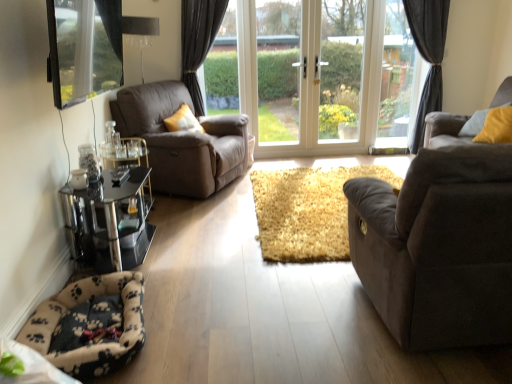
Describe the element at coordinates (182, 140) in the screenshot. I see `matte brown leather armchair at left` at that location.

This screenshot has height=384, width=512. Describe the element at coordinates (398, 80) in the screenshot. I see `clear glass window at upper center, the 1th window frame in the right-to-left sequence` at that location.

Where is `transparent glass window at upper left`? The height and width of the screenshot is (384, 512). transparent glass window at upper left is located at coordinates (83, 49).

This screenshot has height=384, width=512. Describe the element at coordinates (183, 121) in the screenshot. I see `matte yellow pillow at center, which ranks as the 1th pillow in back-to-front order` at that location.

The width and height of the screenshot is (512, 384). Describe the element at coordinates (109, 220) in the screenshot. I see `black glass table at lower left` at that location.

I want to click on dark gray fabric curtain at upper right, so click(428, 56).

Is yellow velvet pillow at right, positioned as the 1th pillow in front-to-back order, facing away from transparent glass window at upper left?

No, transparent glass window at upper left is not at the back of yellow velvet pillow at right, positioned as the 1th pillow in front-to-back order.

Is yellow velvet pillow at right, positioned as the 1th pillow in front-to-back order, not near transparent glass window at upper left?

yellow velvet pillow at right, positioned as the 1th pillow in front-to-back order, is far away from transparent glass window at upper left.

Is transparent glass window at upper left completely or partially inside yellow velvet pillow at right, marked as the 2th pillow in a left-to-right arrangement?

Definitely not — transparent glass window at upper left is not inside yellow velvet pillow at right, marked as the 2th pillow in a left-to-right arrangement.

How many degrees apart are the facing directions of yellow velvet pillow at right, positioned as the 1th pillow in front-to-back order, and transparent glass window at upper left?

yellow velvet pillow at right, positioned as the 1th pillow in front-to-back order, and transparent glass window at upper left are facing 144 degrees away from each other.

Between fluffy beige and black paw print cat bed at lower left, the first cat bed viewed from the left, and matte brown leather armchair at left, which one has less height?

fluffy beige and black paw print cat bed at lower left, the first cat bed viewed from the left.

Are fluffy beige and black paw print cat bed at lower left, which is the first cat bed from bottom to top, and matte brown leather armchair at left located far from each other?

Yes.

Is fluffy beige and black paw print cat bed at lower left, the 2th cat bed when ordered from back to front, wider or thinner than matte brown leather armchair at left?

Clearly, fluffy beige and black paw print cat bed at lower left, the 2th cat bed when ordered from back to front, has less width compared to matte brown leather armchair at left.

Consider the image. How many degrees apart are the facing directions of fluffy beige and black paw print cat bed at lower left, the first cat bed viewed from the left, and matte brown leather armchair at left?

The facing directions of fluffy beige and black paw print cat bed at lower left, the first cat bed viewed from the left, and matte brown leather armchair at left are 24.4 degrees apart.

Is yellow velvet pillow at right, marked as the 2th pillow in a left-to-right arrangement, outside of matte yellow pillow at center, which is the second pillow from front to back?

yellow velvet pillow at right, marked as the 2th pillow in a left-to-right arrangement, lies outside matte yellow pillow at center, which is the second pillow from front to back,'s area.

Does point (507, 103) lie behind point (183, 120)?

No, (507, 103) is closer to viewer.

Does yellow velvet pillow at right, which ranks as the second pillow in back-to-front order, appear on the right side of matte yellow pillow at center, placed as the first pillow when sorted from left to right?

Yes, yellow velvet pillow at right, which ranks as the second pillow in back-to-front order, is to the right of matte yellow pillow at center, placed as the first pillow when sorted from left to right.

Which is behind, yellow velvet pillow at right, marked as the 2th pillow in a left-to-right arrangement, or matte yellow pillow at center, the second pillow when ordered from right to left?

matte yellow pillow at center, the second pillow when ordered from right to left, is further from the camera.

From a real-world perspective, between transparent glass window at upper left and white glass door at center, which ranks as the first window frame in left-to-right order, who is vertically lower?

From a 3D spatial view, white glass door at center, which ranks as the first window frame in left-to-right order, is below.

Are transparent glass window at upper left and white glass door at center, the 2th window frame in the right-to-left sequence, located far from each other?

Absolutely, transparent glass window at upper left is distant from white glass door at center, the 2th window frame in the right-to-left sequence.

Can you confirm if suede-like brown couch at right, arranged as the 1th studio couch when viewed from the left, is wider than dark gray fabric curtain at upper right?

Correct, the width of suede-like brown couch at right, arranged as the 1th studio couch when viewed from the left, exceeds that of dark gray fabric curtain at upper right.

From the image's perspective, would you say suede-like brown couch at right, the 1th studio couch when ordered from front to back, is positioned over dark gray fabric curtain at upper right?

Actually, suede-like brown couch at right, the 1th studio couch when ordered from front to back, appears below dark gray fabric curtain at upper right in the image.

How many degrees apart are the facing directions of suede-like brown couch at right, acting as the 2th studio couch starting from the right, and dark gray fabric curtain at upper right?

suede-like brown couch at right, acting as the 2th studio couch starting from the right, and dark gray fabric curtain at upper right are facing 179 degrees away from each other.

Would you consider suede-like brown couch at right, acting as the 2th studio couch starting from the right, to be distant from dark gray fabric curtain at upper right?

Yes, suede-like brown couch at right, acting as the 2th studio couch starting from the right, and dark gray fabric curtain at upper right are located far from each other.

Is white glossy door at center thinner than matte yellow pillow at center, placed as the first pillow when sorted from left to right?

Yes, white glossy door at center is thinner than matte yellow pillow at center, placed as the first pillow when sorted from left to right.

Is white glossy door at center aimed at matte yellow pillow at center, which is the second pillow from front to back?

Yes, white glossy door at center is oriented towards matte yellow pillow at center, which is the second pillow from front to back.

Does white glossy door at center come behind matte yellow pillow at center, which is the second pillow from front to back?

Yes, it is.

Would you say white glossy door at center is a long distance from matte yellow pillow at center, the second pillow when ordered from right to left?

Yes.

Is matte brown leather armchair at left taller or shorter than suede-like brown couch at right, the second studio couch viewed from the top?

matte brown leather armchair at left is taller than suede-like brown couch at right, the second studio couch viewed from the top.

Considering the relative sizes of matte brown leather armchair at left and suede-like brown couch at right, placed as the second studio couch when sorted from back to front, in the image provided, is matte brown leather armchair at left bigger than suede-like brown couch at right, placed as the second studio couch when sorted from back to front,?

No, matte brown leather armchair at left is not bigger than suede-like brown couch at right, placed as the second studio couch when sorted from back to front.

In terms of width, does matte brown leather armchair at left look wider or thinner when compared to suede-like brown couch at right, placed as the second studio couch when sorted from back to front?

matte brown leather armchair at left is thinner than suede-like brown couch at right, placed as the second studio couch when sorted from back to front.

Is matte brown leather armchair at left not inside suede-like brown couch at right, the 1th studio couch when ordered from front to back?

Absolutely, matte brown leather armchair at left is external to suede-like brown couch at right, the 1th studio couch when ordered from front to back.

From a real-world perspective, starting from the transparent glass window at upper left, which pillow is the 1st one below it? Please provide its 2D coordinates.

[(474, 124)]

Where is `chair lying on the right of fluffy beige and black paw print cat bed at lower left, which ranks as the first cat bed in front-to-back order`? chair lying on the right of fluffy beige and black paw print cat bed at lower left, which ranks as the first cat bed in front-to-back order is located at coordinates 182,140.

Considering their positions, is dark gray fabric curtain at upper right positioned further to soft gray fabric couch at right, placed as the second studio couch when sorted from left to right, than suede-like brown couch at right, placed as the second studio couch when sorted from back to front?

The object further to soft gray fabric couch at right, placed as the second studio couch when sorted from left to right, is suede-like brown couch at right, placed as the second studio couch when sorted from back to front.

Looking at the image, which one is located further to fluffy beige carpet at center, the 1th cat bed viewed from the top, black glass table at lower left or soft gray fabric couch at right, which is counted as the 1th studio couch, starting from the back?

black glass table at lower left.

When comparing their distances from dark gray fabric curtain at upper right, does white glossy door at center or transparent glass window at upper left seem further?

Based on the image, transparent glass window at upper left appears to be further to dark gray fabric curtain at upper right.

Based on their spatial positions, is dark gray fabric curtain at upper right or yellow velvet pillow at right, marked as the first pillow in a right-to-left arrangement, closer to soft gray fabric couch at right, which is counted as the second studio couch, starting from the front?

yellow velvet pillow at right, marked as the first pillow in a right-to-left arrangement.

From the image, which object appears to be nearer to suede-like brown couch at right, acting as the 2th studio couch starting from the right, fluffy beige carpet at center, which is the second cat bed in front-to-back order, or black glass table at lower left?

fluffy beige carpet at center, which is the second cat bed in front-to-back order, is positioned closer to the anchor suede-like brown couch at right, acting as the 2th studio couch starting from the right.

In the scene shown: When comparing their distances from matte brown leather armchair at left, does black glass table at lower left or fluffy beige and black paw print cat bed at lower left, which is the first cat bed from bottom to top, seem closer?

black glass table at lower left.

When comparing their distances from white glossy door at center, does transparent glass window at upper left or yellow velvet pillow at right, marked as the 2th pillow in a left-to-right arrangement, seem further?

transparent glass window at upper left.

Which object lies nearer to the anchor point matte yellow pillow at center, which ranks as the 1th pillow in back-to-front order, black glass table at lower left or clear glass window at upper center, positioned as the 2th window frame in left-to-right order?

black glass table at lower left is positioned closer to the anchor matte yellow pillow at center, which ranks as the 1th pillow in back-to-front order.

At what (x,y) coordinates should I click in order to perform the action: click on pillow between matte brown leather armchair at left and soft gray fabric couch at right, which is counted as the second studio couch, starting from the front, from left to right. Please return your answer as a coordinate pair (x, y). Looking at the image, I should click on (474, 124).

I want to click on pillow located between fluffy beige and black paw print cat bed at lower left, the first cat bed viewed from the left, and yellow velvet pillow at right, positioned as the 1th pillow in front-to-back order, in the left-right direction, so click(x=183, y=121).

I want to click on curtain between transparent glass window at upper left and soft gray fabric couch at right, positioned as the 1th studio couch in top-to-bottom order, in the horizontal direction, so click(x=428, y=56).

At what (x,y) coordinates should I click in order to perform the action: click on curtain between fluffy beige and black paw print cat bed at lower left, the first cat bed viewed from the left, and white glossy door at center in the front-back direction. Please return your answer as a coordinate pair (x, y). Image resolution: width=512 pixels, height=384 pixels. Looking at the image, I should click on (428, 56).